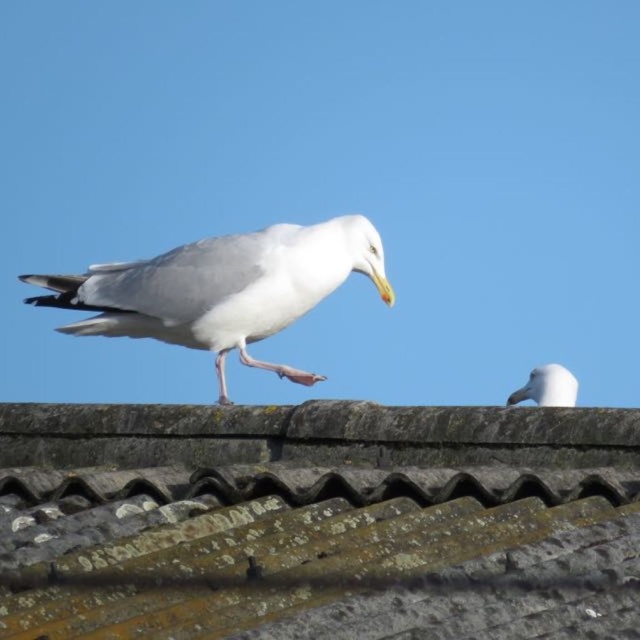
Question: Which of the following is the closest to the observer?

Choices:
 (A) white matte bird at upper center
 (B) white matte bird at center
 (C) rusty corrugated metal tiles at center

Answer: (C)

Question: Based on their relative distances, which object is farther from the white matte bird at upper center?

Choices:
 (A) white matte bird at center
 (B) rusty corrugated metal tiles at center

Answer: (B)

Question: Which object is farther from the camera taking this photo?

Choices:
 (A) white matte bird at upper center
 (B) white matte bird at center

Answer: (A)

Question: Is rusty corrugated metal tiles at center closer to the viewer compared to white matte bird at center?

Choices:
 (A) no
 (B) yes

Answer: (B)

Question: Is rusty corrugated metal tiles at center further to the viewer compared to white matte bird at upper center?

Choices:
 (A) yes
 (B) no

Answer: (B)

Question: Does rusty corrugated metal tiles at center appear on the left side of white matte bird at center?

Choices:
 (A) yes
 (B) no

Answer: (B)